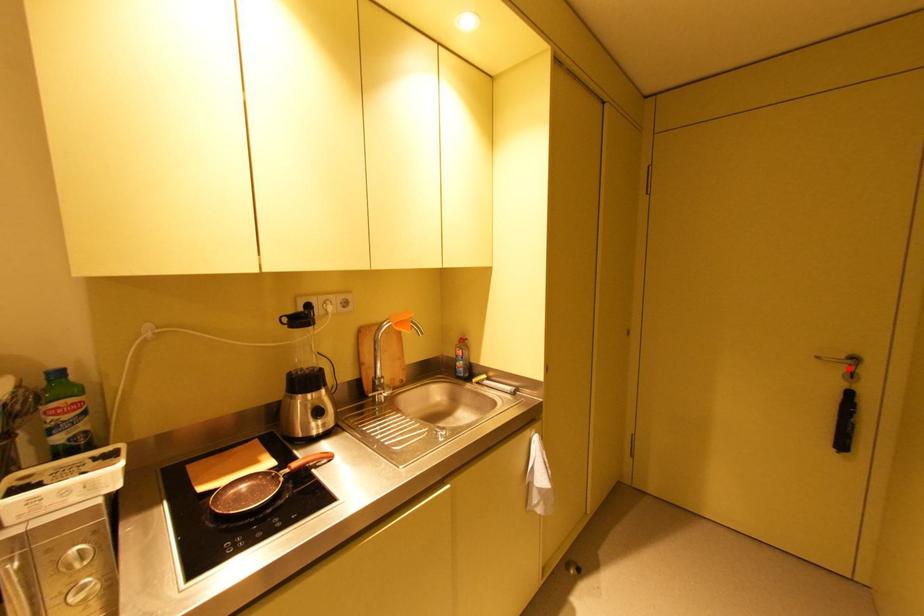
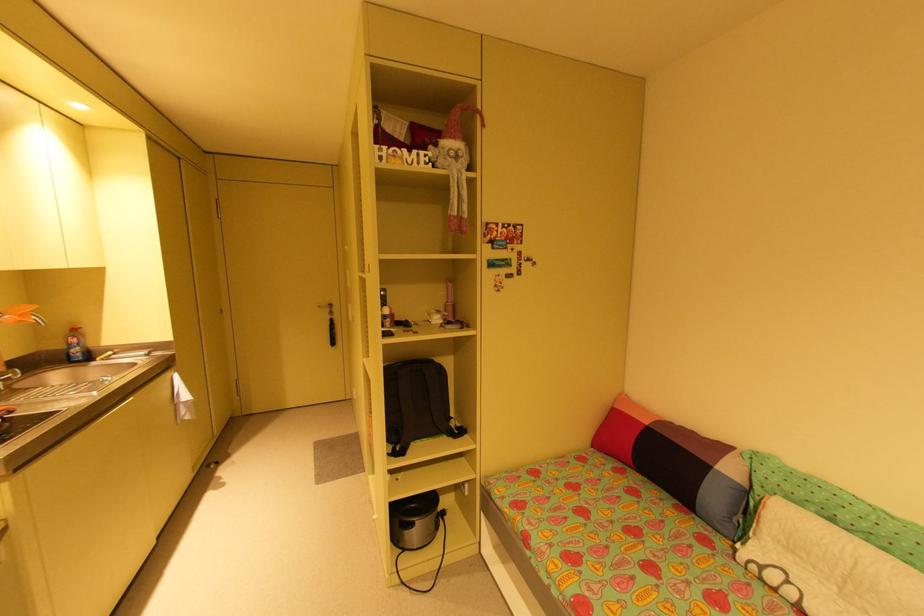
In the second image, find the point that corresponds to the highlighted location in the first image.

(333, 310)